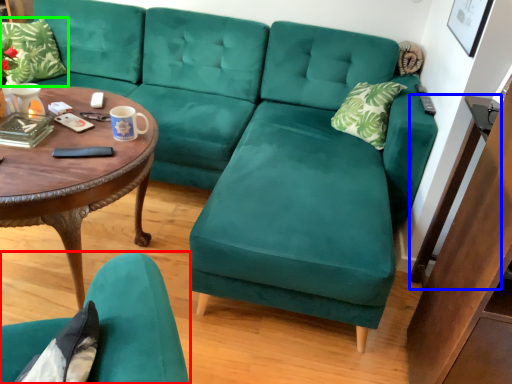
Question: Which object is the farthest from chair (highlighted by a red box)? Choose among these: side table (highlighted by a blue box) or pillow (highlighted by a green box).

Choices:
 (A) side table
 (B) pillow

Answer: (B)